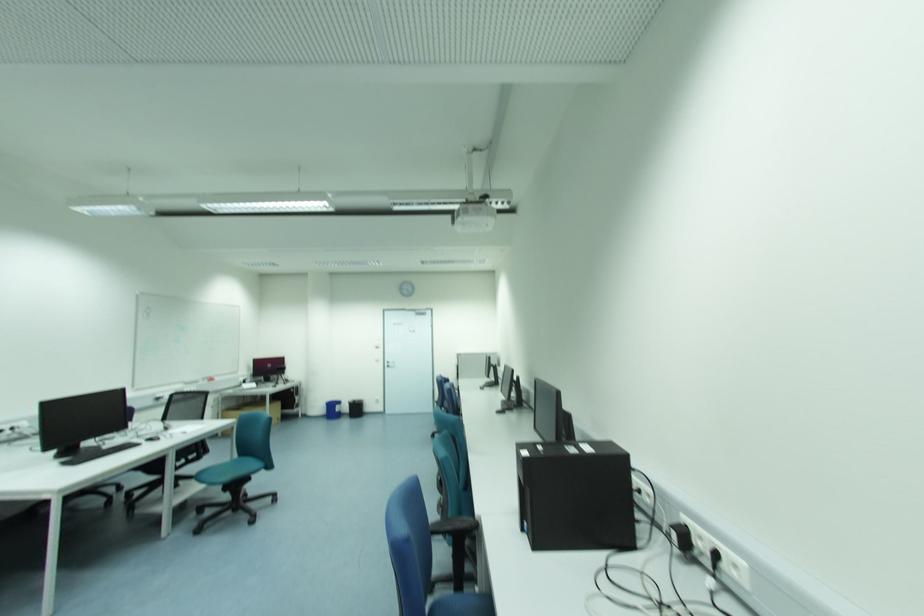
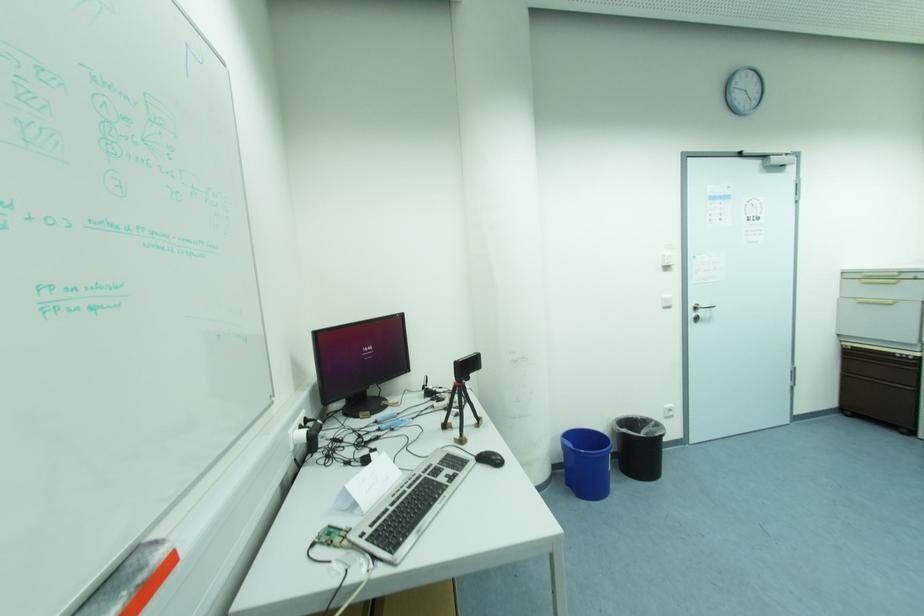
The point at (285, 358) is marked in the first image. Where is the corresponding point in the second image?

(402, 317)